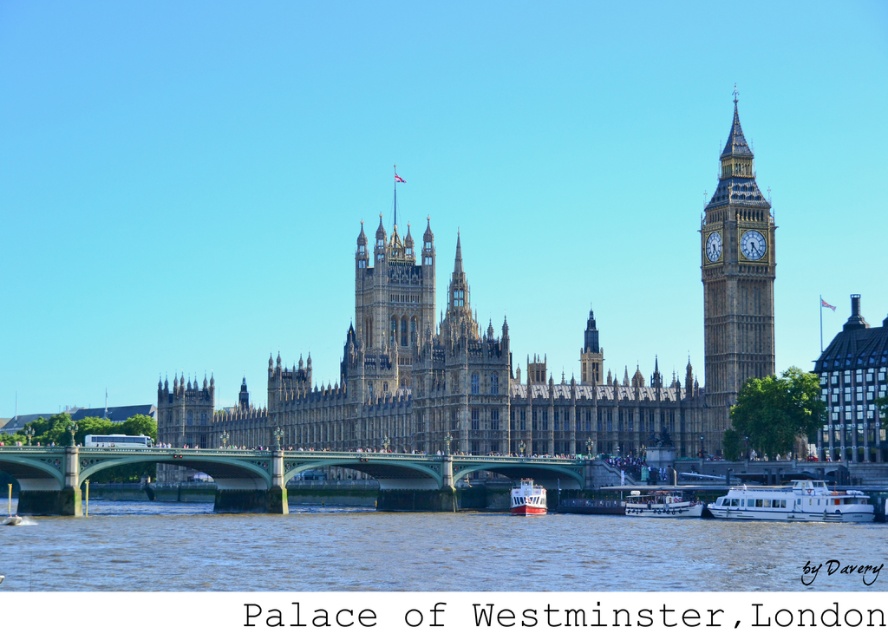
Between brown water at lower center and white stone clock at upper right, which one has less height?

white stone clock at upper right

Can you confirm if brown water at lower center is positioned above white stone clock at upper right?

No.

I want to click on brown water at lower center, so click(x=431, y=552).

The height and width of the screenshot is (640, 888). What do you see at coordinates (734, 285) in the screenshot?
I see `golden stone clock tower at right` at bounding box center [734, 285].

Is point (710, 440) positioned behind point (760, 248)?

Yes.

Find the location of a particular element. golden stone clock tower at right is located at coordinates (734, 285).

Can you confirm if green concrete bridge at center is positioned below white glossy boat at lower right?

No.

Does green concrete bridge at center have a greater height compared to white glossy boat at lower right?

Yes.

Does point (123, 456) come farther from viewer compared to point (809, 516)?

That is True.

The height and width of the screenshot is (640, 888). I want to click on green concrete bridge at center, so click(x=267, y=474).